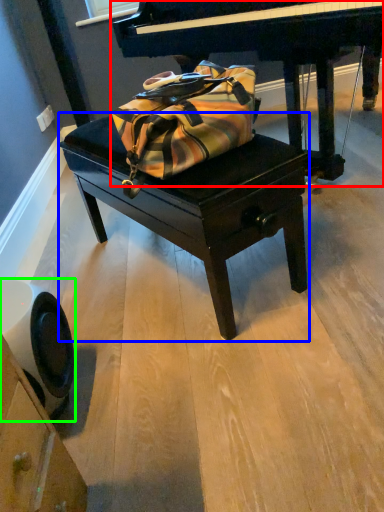
Question: Based on their relative distances, which object is farther from piano (highlighted by a red box)? Choose from table (highlighted by a blue box) and swivel chair (highlighted by a green box).

Choices:
 (A) table
 (B) swivel chair

Answer: (B)